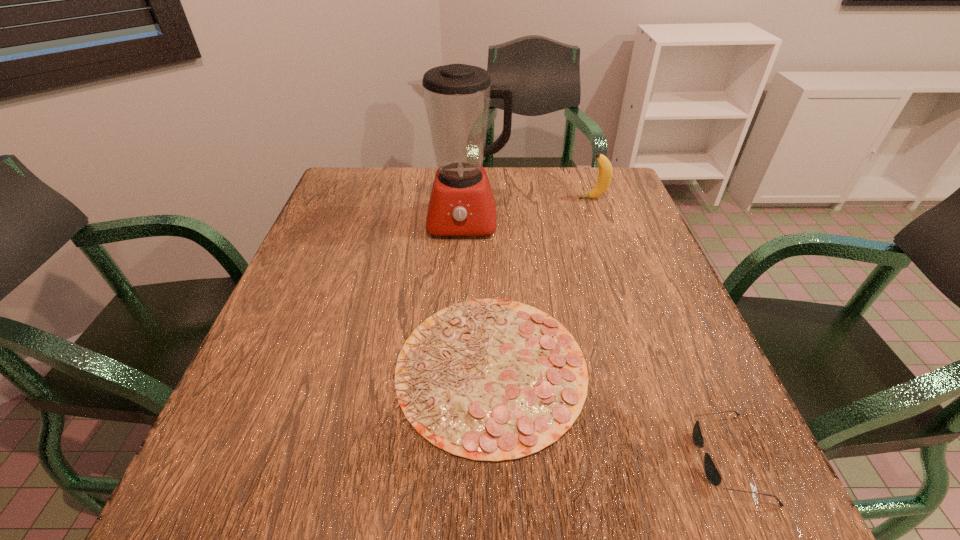
In order to click on blender in this screenshot , I will do `click(457, 97)`.

Locate an element on the screen. This screenshot has height=540, width=960. the tallest object is located at coordinates (457, 97).

Image resolution: width=960 pixels, height=540 pixels. I want to click on the second tallest object, so click(605, 168).

The width and height of the screenshot is (960, 540). Identify the location of the farthest object. (605, 168).

Where is `pizza`? This screenshot has height=540, width=960. pizza is located at coordinates tap(493, 379).

I want to click on sunglasses, so click(x=711, y=471).

In order to click on vacant space located on the front of the second farthest object near the controls in this screenshot , I will do tap(458, 332).

Locate an element on the screen. The height and width of the screenshot is (540, 960). vacant space situated 0.320m from the stem of the second tallest object is located at coordinates (472, 199).

At what (x,y) coordinates should I click in order to perform the action: click on vacant space located 0.330m from the stem of the second tallest object. Please return your answer as a coordinate pair (x, y). Image resolution: width=960 pixels, height=540 pixels. Looking at the image, I should click on (468, 199).

This screenshot has width=960, height=540. In order to click on vacant space located 0.400m from the stem of the second tallest object in this screenshot , I will do `click(445, 199)`.